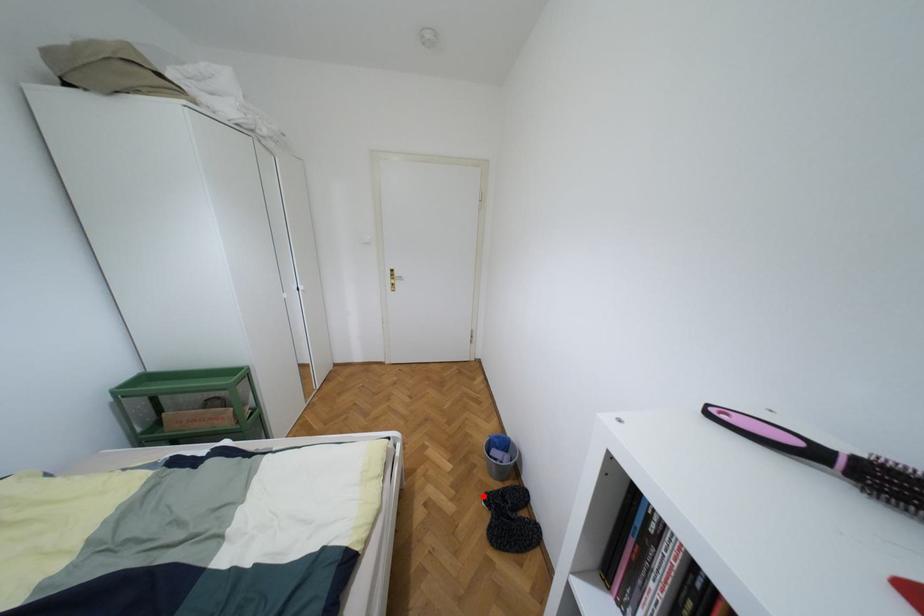
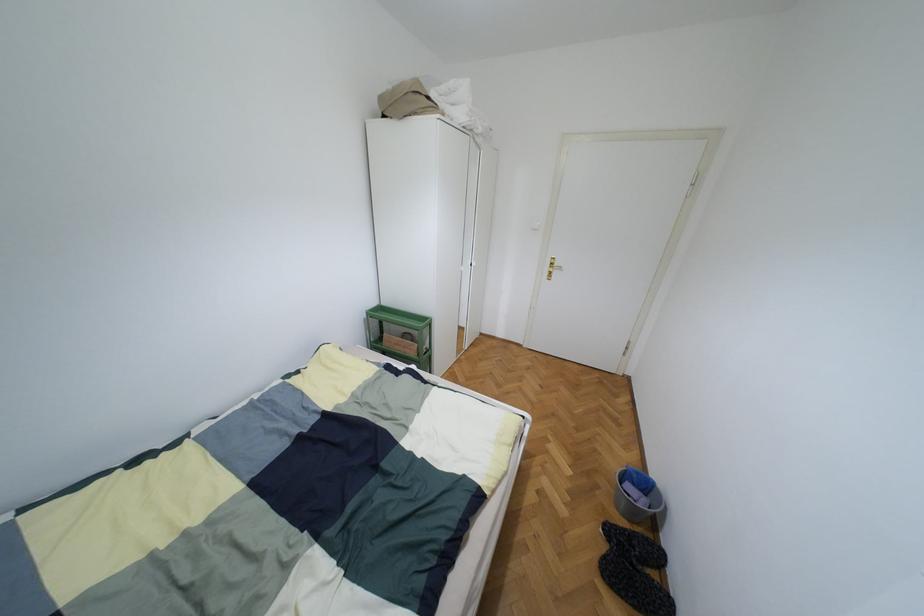
Question: I am providing you with two images of the same scene from different viewpoints. Given a red point in image1, look at the same physical point in image2. Is it:

Choices:
 (A) Closer to the viewpoint
 (B) Farther from the viewpoint

Answer: (B)